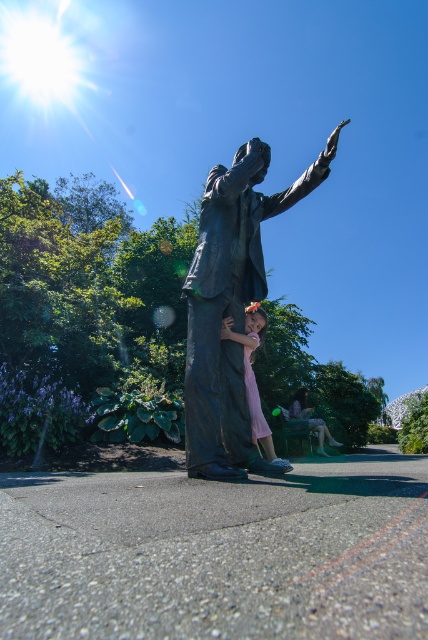
Can you confirm if pink fabric dress at center is bigger than matte green dress at lower right?

No, pink fabric dress at center is not bigger than matte green dress at lower right.

Is pink fabric dress at center in front of matte green dress at lower right?

Yes, pink fabric dress at center is in front of matte green dress at lower right.

This screenshot has height=640, width=428. What do you see at coordinates (253, 378) in the screenshot?
I see `pink fabric dress at center` at bounding box center [253, 378].

The height and width of the screenshot is (640, 428). What are the coordinates of `pink fabric dress at center` in the screenshot? It's located at (253, 378).

Is bronze statue at center smaller than pink fabric dress at center?

No, bronze statue at center is not smaller than pink fabric dress at center.

Is bronze statue at center wider than pink fabric dress at center?

Indeed, bronze statue at center has a greater width compared to pink fabric dress at center.

Is point (219, 429) positioned before point (259, 428)?

Yes, it is.

This screenshot has width=428, height=640. I want to click on bronze statue at center, so click(x=231, y=305).

Is bronze statue at center bigger than matte green dress at lower right?

Yes, bronze statue at center is bigger than matte green dress at lower right.

Is point (243, 256) behind point (323, 428)?

No.

The height and width of the screenshot is (640, 428). I want to click on bronze statue at center, so click(231, 305).